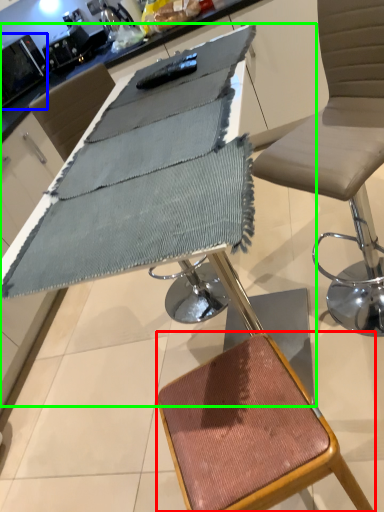
Question: Which object is the farthest from stool (highlighted by a red box)? Choose among these: appliance (highlighted by a blue box) or table (highlighted by a green box).

Choices:
 (A) appliance
 (B) table

Answer: (A)